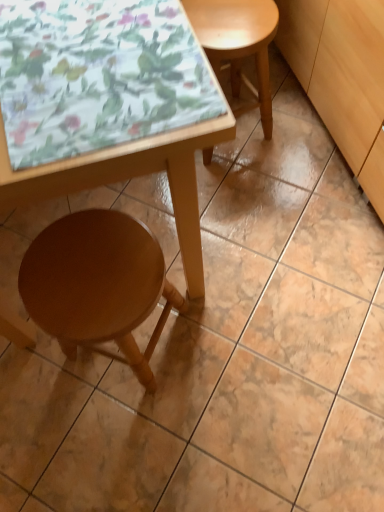
You are a GUI agent. You are given a task and a screenshot of the screen. Output one action in this format:
    pyautogui.click(x=<x>, y=<y>)
    Task: Click on the free spot in front of wooden stool at lower left, which ranks as the second stool in top-to-bottom order
    
    Given the screenshot: What is the action you would take?
    pyautogui.click(x=123, y=453)